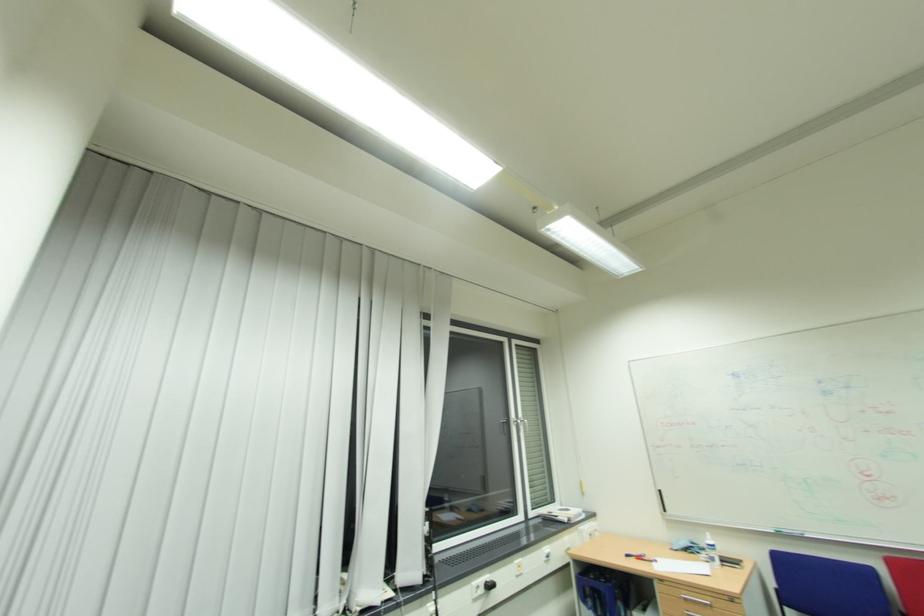
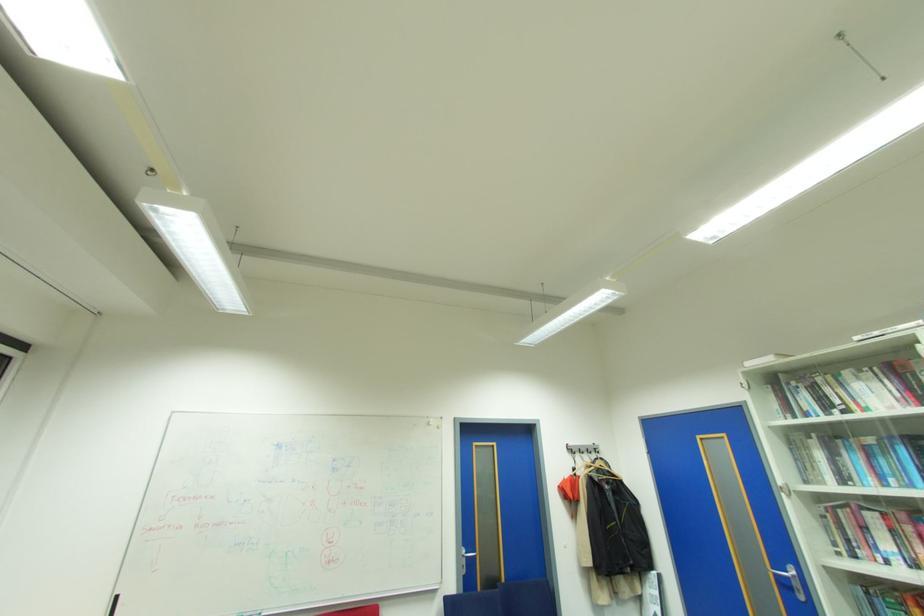
In the second image, find the point that corresponds to point (748, 410) in the first image.

(274, 482)